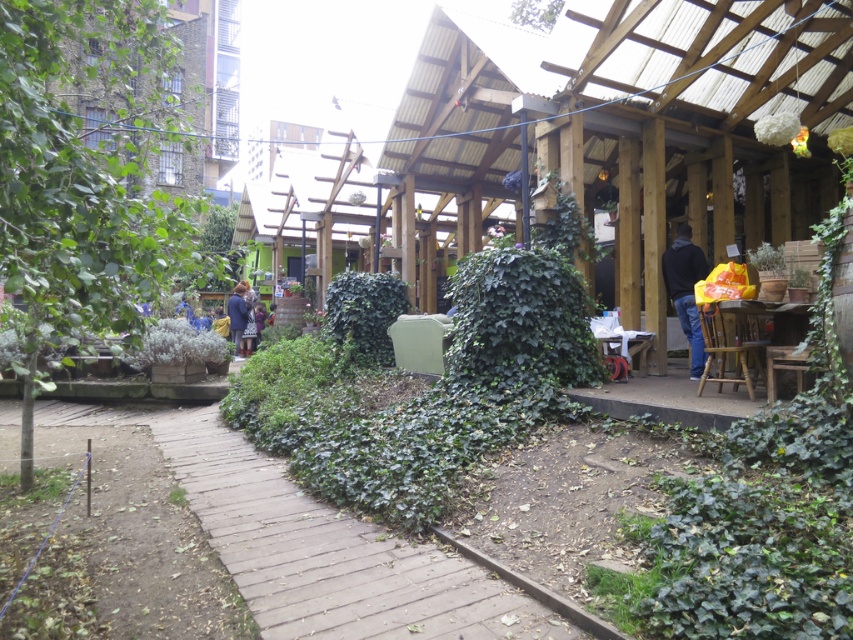
Can you confirm if dark blue hoodie at right is positioned below wooden table at center?

Incorrect, dark blue hoodie at right is not positioned below wooden table at center.

Is dark blue hoodie at right thinner than wooden table at center?

Yes.

Image resolution: width=853 pixels, height=640 pixels. Find the location of `dark blue hoodie at right`. dark blue hoodie at right is located at coordinates pos(685,291).

Is wooden table at right thinner than blue fabric jacket at center-left?

In fact, wooden table at right might be wider than blue fabric jacket at center-left.

Who is positioned more to the right, wooden table at right or blue fabric jacket at center-left?

From the viewer's perspective, wooden table at right appears more on the right side.

Is point (801, 368) closer to camera compared to point (239, 288)?

Yes, point (801, 368) is closer to viewer.

At what (x,y) coordinates should I click in order to perform the action: click on wooden table at right. Please return your answer as a coordinate pair (x, y). The image size is (853, 640). Looking at the image, I should click on (761, 307).

Which is behind, point (132, 214) or point (231, 320)?

Point (231, 320)

Which of these two, green leafy bush at left or blue fabric jacket at center-left, stands shorter?

blue fabric jacket at center-left is shorter.

Where is `green leafy bush at left`? The height and width of the screenshot is (640, 853). green leafy bush at left is located at coordinates (86, 172).

The width and height of the screenshot is (853, 640). I want to click on green leafy bush at left, so click(x=86, y=172).